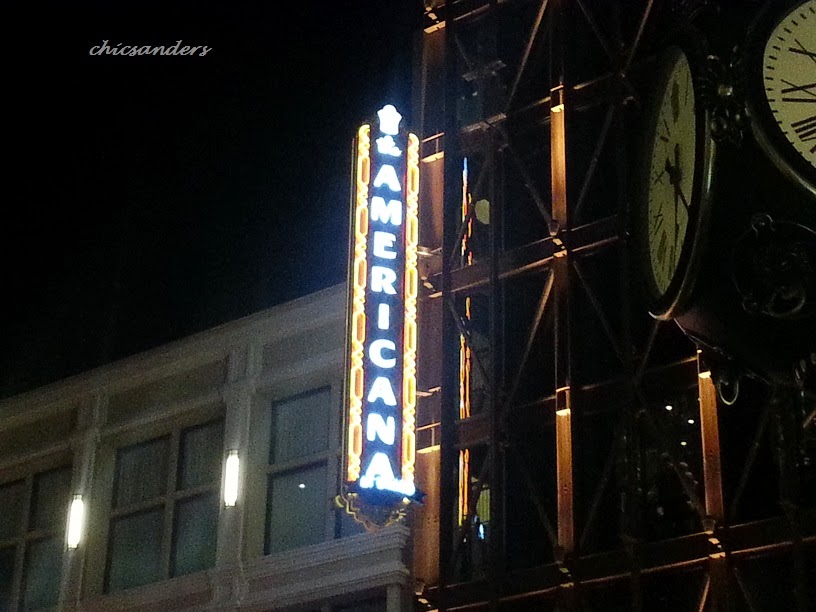
Where is `clock 2`? The width and height of the screenshot is (816, 612). clock 2 is located at coordinates (792, 130).